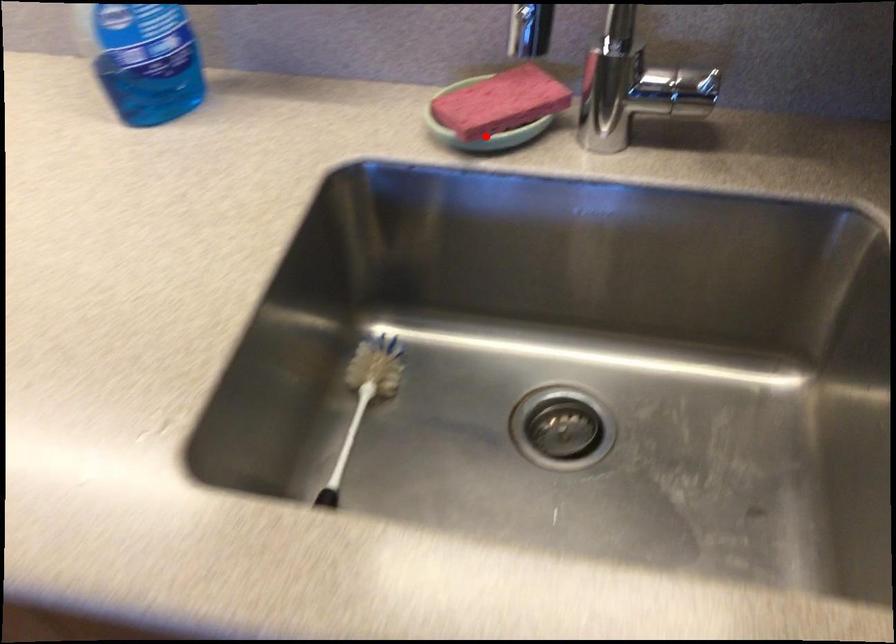
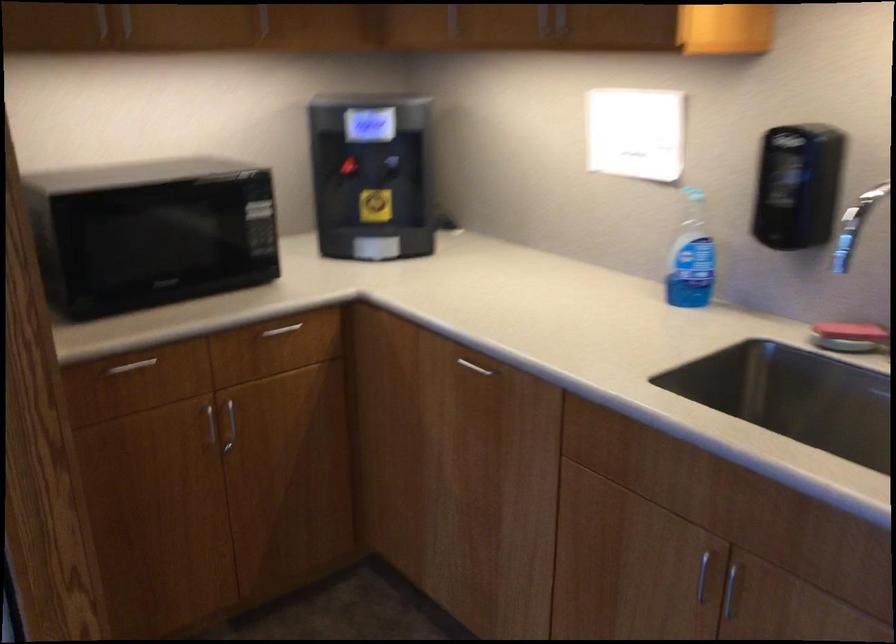
Question: I am providing you with two images of the same scene from different viewpoints. A red point is shown in image1. For the corresponding object point in image2, is it positioned nearer or farther from the camera?

Choices:
 (A) Nearer
 (B) Farther

Answer: (B)